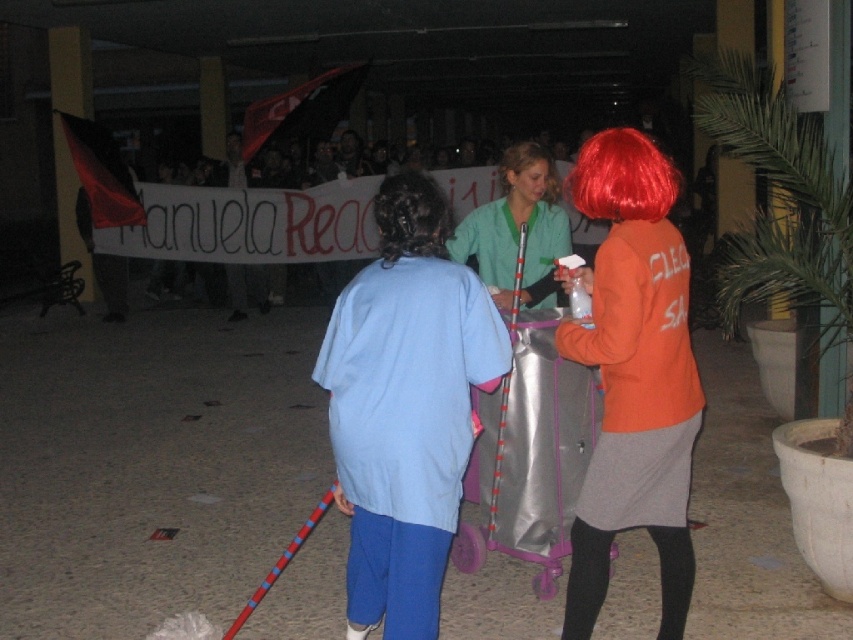
Question: Which of the following is the closest to the observer?

Choices:
 (A) (409, 337)
 (B) (438, 211)
 (C) (578, 161)
 (D) (485, 209)

Answer: (A)

Question: Does orange matte jacket at right appear on the left side of green smoothie at center?

Choices:
 (A) yes
 (B) no

Answer: (B)

Question: Is green smoothie at center smaller than curly brown hair at center?

Choices:
 (A) no
 (B) yes

Answer: (A)

Question: Which point appears closest to the camera in this image?

Choices:
 (A) (424, 493)
 (B) (666, 182)
 (C) (581, 564)

Answer: (A)

Question: Among these objects, which one is farthest from the camera?

Choices:
 (A) green smoothie at center
 (B) light blue fabric shirt at center
 (C) red synthetic wig at upper right
 (D) orange matte jacket at right

Answer: (A)

Question: Can you confirm if light blue fabric shirt at center is thinner than red synthetic wig at upper right?

Choices:
 (A) yes
 (B) no

Answer: (B)